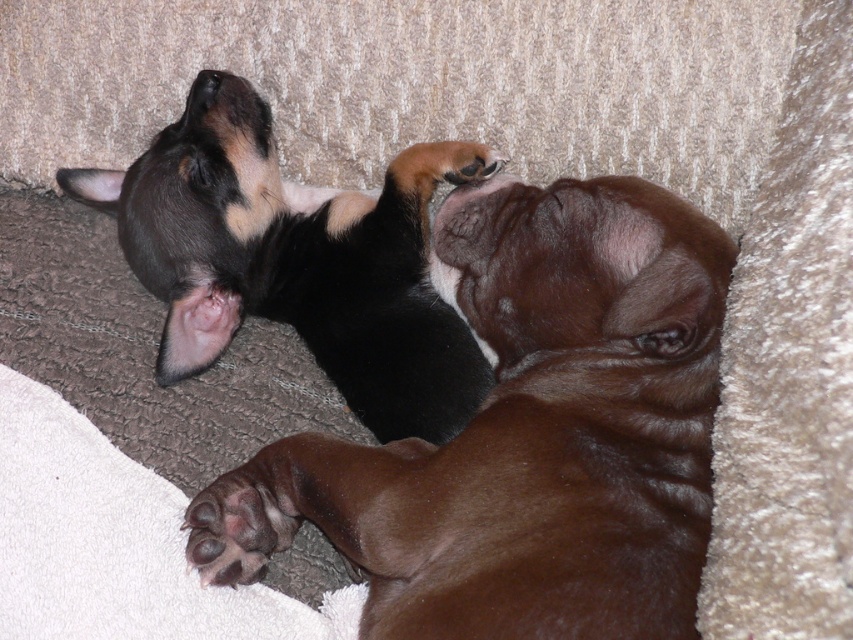
Does brown smooth dog at center have a lesser width compared to black matte dog at upper left?

Incorrect, brown smooth dog at center's width is not less than black matte dog at upper left's.

Which is behind, point (350, 541) or point (328, 358)?

Positioned behind is point (328, 358).

Find the location of a particular element. brown smooth dog at center is located at coordinates (525, 433).